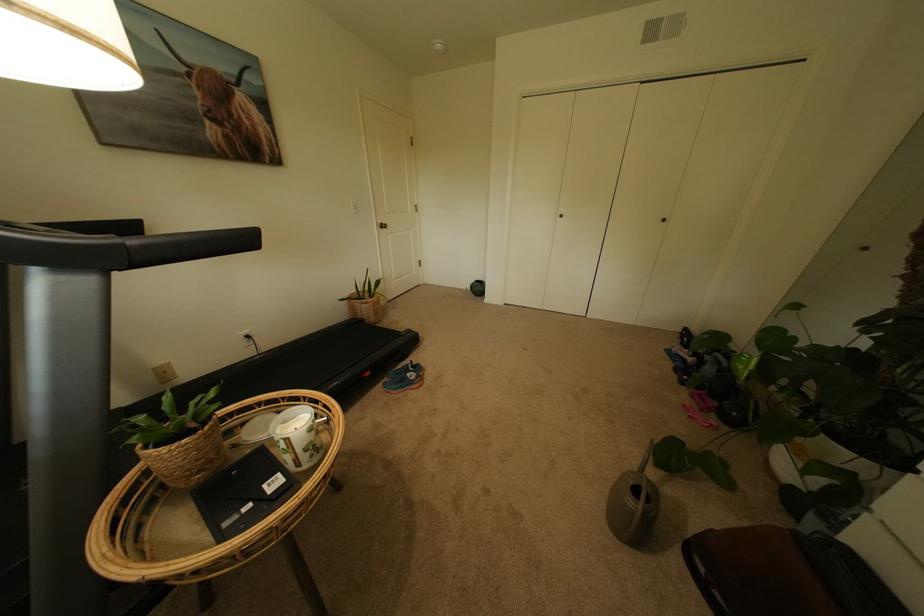
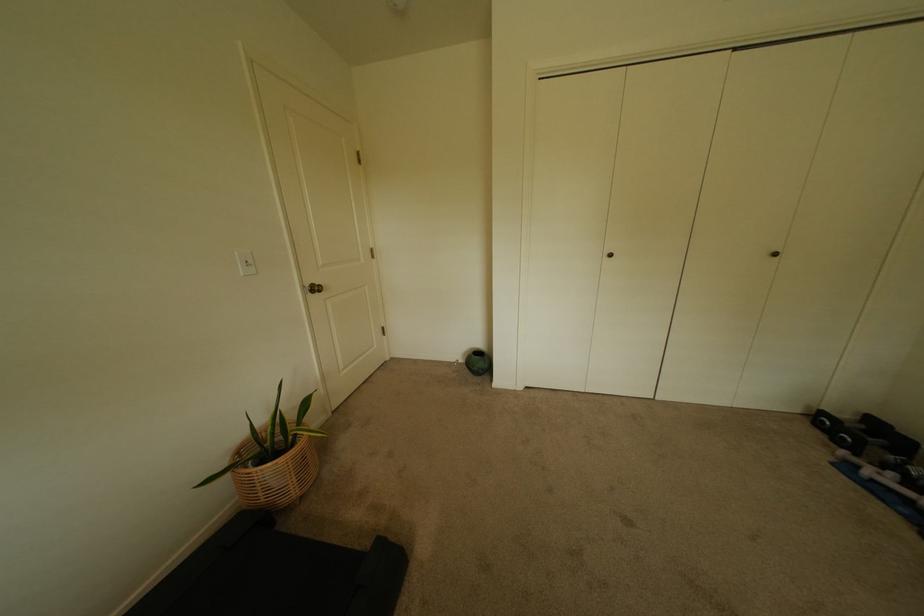
In the second image, find the point that corresponds to (569,217) in the first image.

(618, 256)